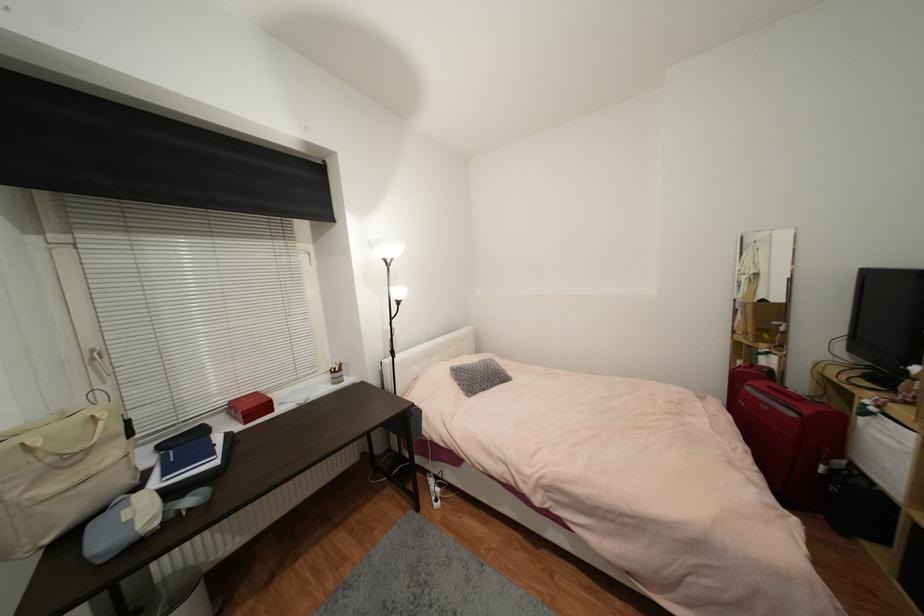
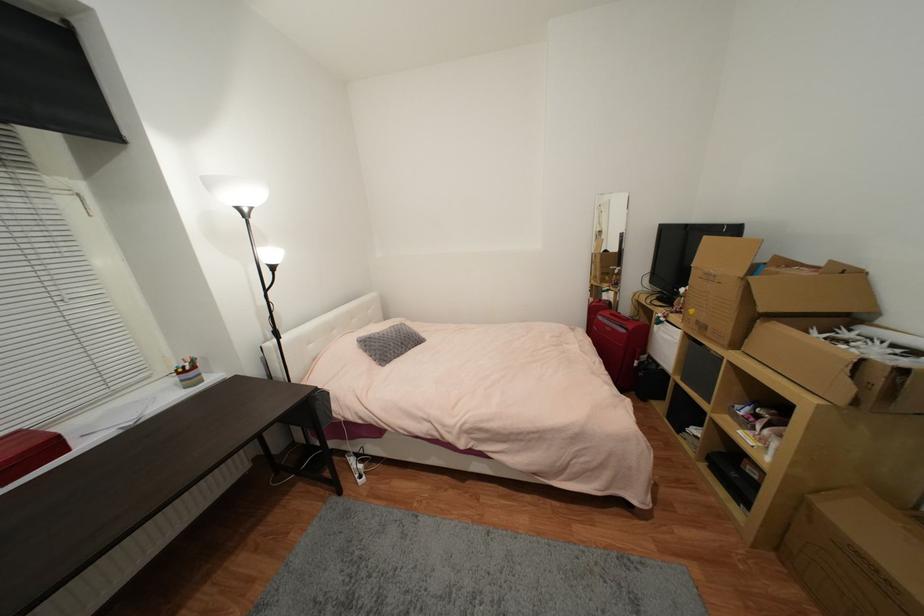
Question: The first image is from the beginning of the video and the second image is from the end. How did the camera likely rotate when shooting the video?

Choices:
 (A) Left
 (B) Right
 (C) Up
 (D) Down

Answer: (B)